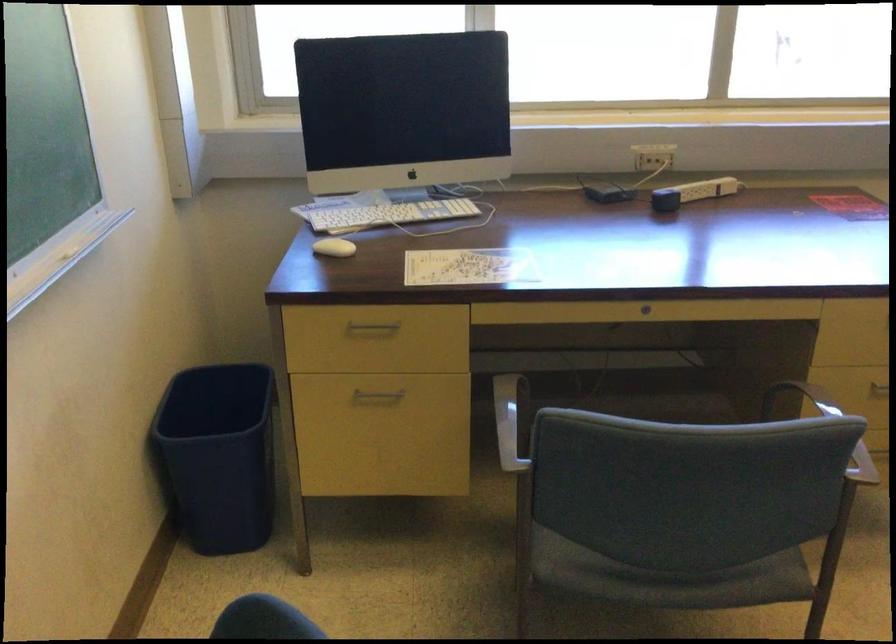
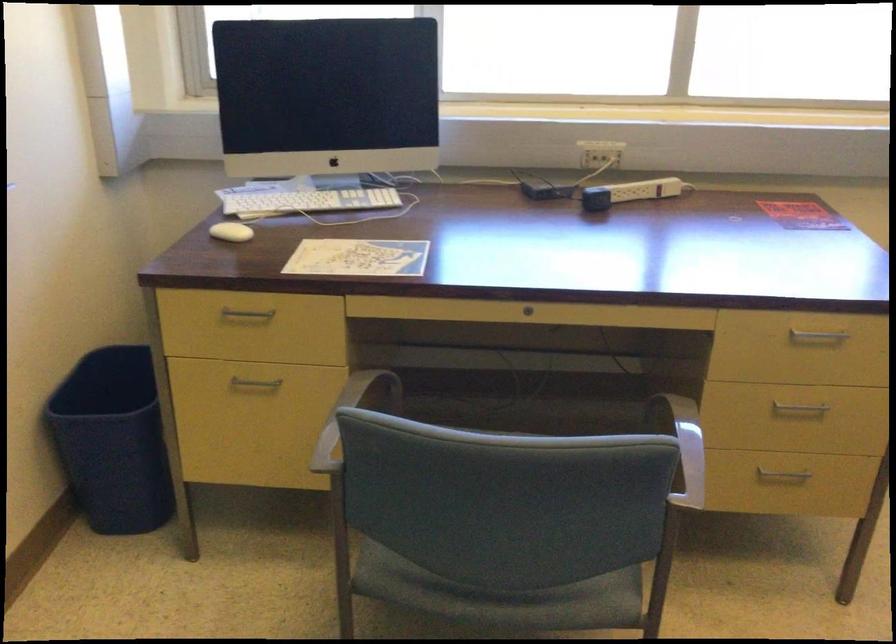
In the second image, find the point that corresponds to the point at 547,412 in the first image.

(350, 415)